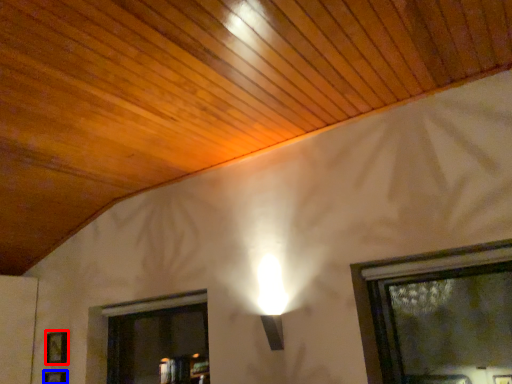
Question: Which of the following is the farthest to the observer, picture frame (highlighted by a red box) or picture frame (highlighted by a blue box)?

Choices:
 (A) picture frame
 (B) picture frame

Answer: (A)